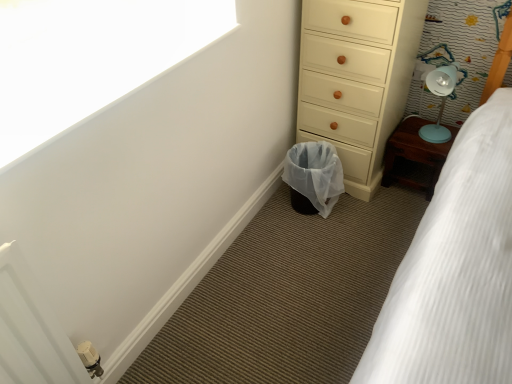
This screenshot has height=384, width=512. I want to click on wooden bedside table at right, so click(x=414, y=156).

The height and width of the screenshot is (384, 512). Describe the element at coordinates (455, 269) in the screenshot. I see `white textured bed at lower right` at that location.

The height and width of the screenshot is (384, 512). I want to click on white matte window screen at upper left, so click(89, 58).

Locate an element on the screen. This screenshot has width=512, height=384. matte cream chest of drawers at lower right is located at coordinates (356, 79).

Where is `wooden bedside table at right`? The width and height of the screenshot is (512, 384). wooden bedside table at right is located at coordinates (414, 156).

Is there a large distance between white matte window screen at upper left and wooden bedside table at right?

white matte window screen at upper left is positioned a significant distance from wooden bedside table at right.

From a real-world perspective, is white matte window screen at upper left positioned above or below wooden bedside table at right?

white matte window screen at upper left is situated higher than wooden bedside table at right in the real world.

Can you confirm if white matte window screen at upper left is thinner than wooden bedside table at right?

Incorrect, the width of white matte window screen at upper left is not less than that of wooden bedside table at right.

Is point (182, 5) positioned after point (405, 147)?

No.

Who is more distant, white textured bed at lower right or wooden bedside table at right?

wooden bedside table at right is more distant.

Consider the image. Considering the sizes of white textured bed at lower right and wooden bedside table at right in the image, is white textured bed at lower right bigger or smaller than wooden bedside table at right?

Clearly, white textured bed at lower right is larger in size than wooden bedside table at right.

From a real-world perspective, which is physically above, white textured bed at lower right or wooden bedside table at right?

In real-world perspective, white textured bed at lower right is above.

From their relative heights in the image, would you say white textured bed at lower right is taller or shorter than wooden bedside table at right?

Clearly, white textured bed at lower right is taller compared to wooden bedside table at right.

Can you confirm if translucent plastic laundry basket at lower center is thinner than white textured bed at lower right?

Yes, translucent plastic laundry basket at lower center is thinner than white textured bed at lower right.

Consider the image. Considering the sizes of objects translucent plastic laundry basket at lower center and white textured bed at lower right in the image provided, who is taller, translucent plastic laundry basket at lower center or white textured bed at lower right?

Standing taller between the two is white textured bed at lower right.

Based on the photo, could white textured bed at lower right be considered to be inside translucent plastic laundry basket at lower center?

That's incorrect, white textured bed at lower right is not inside translucent plastic laundry basket at lower center.

Is matte cream chest of drawers at lower right at the back of white textured bed at lower right?

white textured bed at lower right is not turned away from matte cream chest of drawers at lower right.

Considering the relative positions of white textured bed at lower right and matte cream chest of drawers at lower right in the image provided, is white textured bed at lower right behind matte cream chest of drawers at lower right?

No, white textured bed at lower right is closer to the camera.

Is white textured bed at lower right spatially inside matte cream chest of drawers at lower right, or outside of it?

white textured bed at lower right cannot be found inside matte cream chest of drawers at lower right.

Can you tell me how much white textured bed at lower right and matte cream chest of drawers at lower right differ in facing direction?

The angular difference between white textured bed at lower right and matte cream chest of drawers at lower right is 1.05 degrees.

Does point (397, 161) come behind point (39, 18)?

Yes, it is behind point (39, 18).

Which is more to the right, wooden bedside table at right or white matte window screen at upper left?

wooden bedside table at right.

From the image's perspective, who appears lower, wooden bedside table at right or white matte window screen at upper left?

From the image's view, wooden bedside table at right is below.

Image resolution: width=512 pixels, height=384 pixels. I want to click on window screen located on the left of wooden bedside table at right, so click(89, 58).

Is matte cream chest of drawers at lower right looking in the opposite direction of wooden bedside table at right?

No, matte cream chest of drawers at lower right's orientation is not away from wooden bedside table at right.

From a real-world perspective, is matte cream chest of drawers at lower right above or below wooden bedside table at right?

matte cream chest of drawers at lower right is above wooden bedside table at right.

From the image's perspective, is matte cream chest of drawers at lower right positioned above or below wooden bedside table at right?

Based on their image positions, matte cream chest of drawers at lower right is located above wooden bedside table at right.

From the picture: Would you say matte cream chest of drawers at lower right contains wooden bedside table at right?

Actually, wooden bedside table at right is outside matte cream chest of drawers at lower right.

Considering the sizes of objects wooden bedside table at right and matte cream chest of drawers at lower right in the image provided, who is wider, wooden bedside table at right or matte cream chest of drawers at lower right?

matte cream chest of drawers at lower right is wider.

From a real-world perspective, is wooden bedside table at right beneath matte cream chest of drawers at lower right?

Yes.

From the image's perspective, is wooden bedside table at right above or below matte cream chest of drawers at lower right?

From the image's perspective, wooden bedside table at right appears below matte cream chest of drawers at lower right.

Considering the sizes of objects wooden bedside table at right and matte cream chest of drawers at lower right in the image provided, who is bigger, wooden bedside table at right or matte cream chest of drawers at lower right?

matte cream chest of drawers at lower right is bigger.

Find the location of a particular element. The image size is (512, 384). window screen to the left of wooden bedside table at right is located at coordinates (89, 58).

The height and width of the screenshot is (384, 512). Identify the location of furniture that is under the white textured bed at lower right (from a real-world perspective). (414, 156).

Considering their positions, is wooden bedside table at right positioned further to white matte window screen at upper left than matte cream chest of drawers at lower right?

wooden bedside table at right is further to white matte window screen at upper left.

Based on their spatial positions, is matte cream chest of drawers at lower right or translucent plastic laundry basket at lower center closer to white textured bed at lower right?

Based on the image, matte cream chest of drawers at lower right appears to be nearer to white textured bed at lower right.

Which object lies further to the anchor point translucent plastic laundry basket at lower center, white textured bed at lower right or wooden bedside table at right?

white textured bed at lower right is further to translucent plastic laundry basket at lower center.

From the image, which object appears to be nearer to white textured bed at lower right, matte cream chest of drawers at lower right or wooden bedside table at right?

matte cream chest of drawers at lower right is closer to white textured bed at lower right.

Based on the photo, based on their spatial positions, is translucent plastic laundry basket at lower center or matte cream chest of drawers at lower right closer to white textured bed at lower right?

The object closer to white textured bed at lower right is matte cream chest of drawers at lower right.

Which object lies further to the anchor point white matte window screen at upper left, white textured bed at lower right or translucent plastic laundry basket at lower center?

white textured bed at lower right.

Estimate the real-world distances between objects in this image. Which object is closer to white textured bed at lower right, wooden bedside table at right or translucent plastic laundry basket at lower center?

wooden bedside table at right is positioned closer to the anchor white textured bed at lower right.

Considering their positions, is white matte window screen at upper left positioned further to translucent plastic laundry basket at lower center than matte cream chest of drawers at lower right?

Based on the image, white matte window screen at upper left appears to be further to translucent plastic laundry basket at lower center.

At what (x,y) coordinates should I click in order to perform the action: click on window screen between white textured bed at lower right and translucent plastic laundry basket at lower center along the z-axis. Please return your answer as a coordinate pair (x, y). The height and width of the screenshot is (384, 512). Looking at the image, I should click on (89, 58).

The height and width of the screenshot is (384, 512). What are the coordinates of `chest of drawers between white matte window screen at upper left and wooden bedside table at right in the horizontal direction` in the screenshot? It's located at [x=356, y=79].

Identify the location of window screen located between white textured bed at lower right and wooden bedside table at right in the depth direction. (89, 58).

Identify the location of laundry basket between white textured bed at lower right and wooden bedside table at right from front to back. (315, 173).